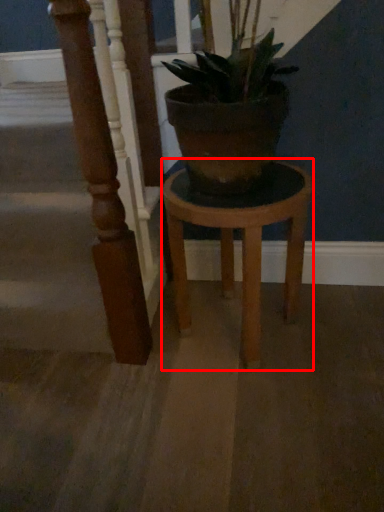
Question: From the image, what is the correct spatial relationship of stool (annotated by the red box) in relation to pillar?

Choices:
 (A) right
 (B) left

Answer: (A)